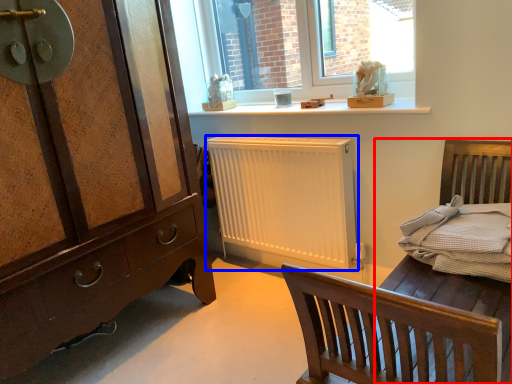
Question: Among these objects, which one is farthest to the camera, bed frame (highlighted by a red box) or radiator (highlighted by a blue box)?

Choices:
 (A) bed frame
 (B) radiator

Answer: (B)